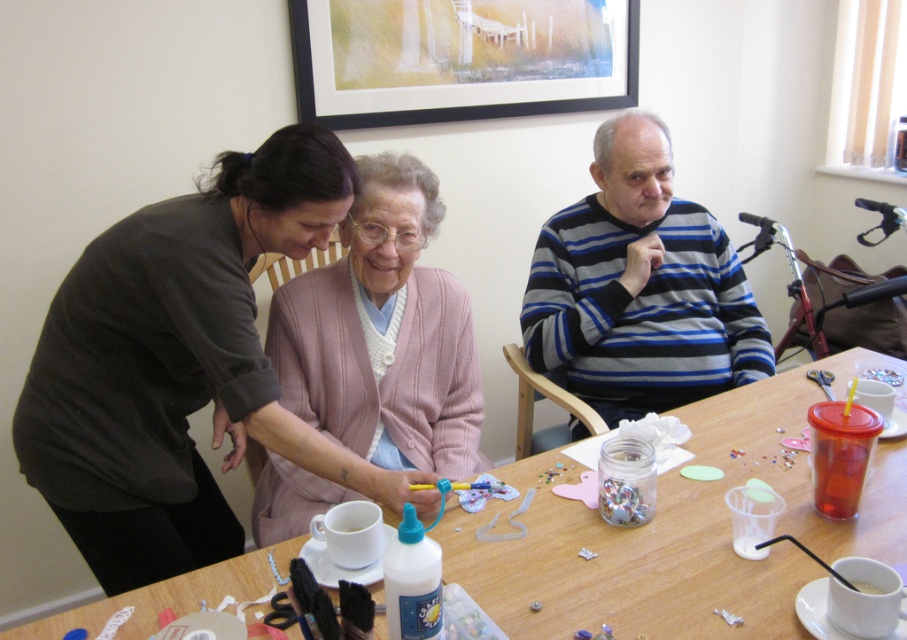
Question: Which object appears closest to the camera in this image?

Choices:
 (A) wooden table at center
 (B) matte black sweater at upper left

Answer: (A)

Question: Which object is the closest to the wooden framed artwork at upper center?

Choices:
 (A) matte black sweater at upper left
 (B) wooden table at center

Answer: (A)

Question: Is striped sweater at upper right below white glossy bottle at lower center?

Choices:
 (A) no
 (B) yes

Answer: (A)

Question: Which object is farther from the camera taking this photo?

Choices:
 (A) white glossy bottle at lower center
 (B) matte black sweater at upper left
 (C) wooden framed artwork at upper center

Answer: (C)

Question: Can you confirm if wooden table at center is positioned below wooden framed artwork at upper center?

Choices:
 (A) yes
 (B) no

Answer: (A)

Question: Does matte black sweater at upper left have a larger size compared to wooden table at center?

Choices:
 (A) yes
 (B) no

Answer: (B)